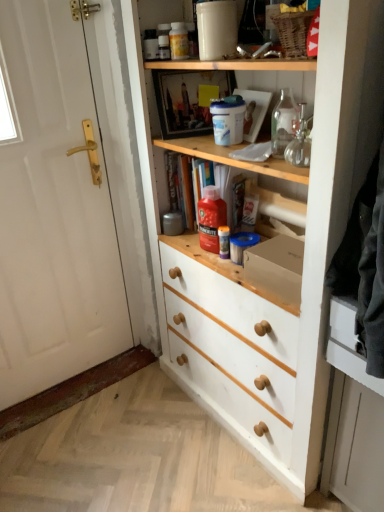
This screenshot has height=512, width=384. What do you see at coordinates (53, 211) in the screenshot? I see `white matte door at left` at bounding box center [53, 211].

Looking at this image, what is the approximate height of white matte drawer at lower right?

It is 22.89 centimeters.

This screenshot has height=512, width=384. In order to click on translucent plastic bottle at upper center, which is the 1th bottle from left to right in this screenshot , I will do `click(178, 41)`.

You are a GUI agent. You are given a task and a screenshot of the screen. Output one action in this format:
    pyautogui.click(x=<x>, y=<y>)
    Task: Click on the white matte door at left
    
    Given the screenshot: What is the action you would take?
    pyautogui.click(x=53, y=211)

Considering the sizes of objects transparent glass bottle at upper right and translucent plastic bottle at upper center, marked as the 1th bottle in a top-to-bottom arrangement, in the image provided, who is thinner, transparent glass bottle at upper right or translucent plastic bottle at upper center, marked as the 1th bottle in a top-to-bottom arrangement,?

Thinner between the two is transparent glass bottle at upper right.

Considering the relative sizes of transparent glass bottle at upper right and translucent plastic bottle at upper center, which is the 1th bottle from left to right, in the image provided, is transparent glass bottle at upper right taller than translucent plastic bottle at upper center, which is the 1th bottle from left to right,?

Correct, transparent glass bottle at upper right is much taller as translucent plastic bottle at upper center, which is the 1th bottle from left to right.

Is the position of transparent glass bottle at upper right more distant than that of translucent plastic bottle at upper center, marked as the 1th bottle in a top-to-bottom arrangement?

No, transparent glass bottle at upper right is in front of translucent plastic bottle at upper center, marked as the 1th bottle in a top-to-bottom arrangement.

Which is farther from the camera, (275, 296) or (333, 362)?

Point (275, 296)

Is white painted wood cupboard at center bigger or smaller than white matte drawer at lower right?

In the image, white painted wood cupboard at center appears to be larger than white matte drawer at lower right.

From the image's perspective, does white painted wood cupboard at center appear lower than white matte drawer at lower right?

Incorrect, from the image's perspective, white painted wood cupboard at center is higher than white matte drawer at lower right.

Consider the image. Is white painted wood cupboard at center behind white matte drawer at lower right?

No, white painted wood cupboard at center is in front of white matte drawer at lower right.

Considering the positions of objects translucent plastic bottle at upper center, which is the 1th bottle from left to right, and white matte door at left in the image provided, who is behind, translucent plastic bottle at upper center, which is the 1th bottle from left to right, or white matte door at left?

translucent plastic bottle at upper center, which is the 1th bottle from left to right.

From the image's perspective, does translucent plastic bottle at upper center, which is counted as the second bottle, starting from the bottom, appear lower than white matte door at left?

No.

Are translucent plastic bottle at upper center, marked as the 1th bottle in a top-to-bottom arrangement, and white matte door at left located far from each other?

No, translucent plastic bottle at upper center, marked as the 1th bottle in a top-to-bottom arrangement, is in close proximity to white matte door at left.

Between white matte drawer at lower right and transparent glass bottle at upper right, which one has smaller size?

transparent glass bottle at upper right.

Which is more to the left, white matte drawer at lower right or transparent glass bottle at upper right?

From the viewer's perspective, transparent glass bottle at upper right appears more on the left side.

From their relative heights in the image, would you say white matte drawer at lower right is taller or shorter than transparent glass bottle at upper right?

In the image, white matte drawer at lower right appears to be taller than transparent glass bottle at upper right.

How many degrees apart are the facing directions of white matte drawer at lower right and transparent glass bottle at upper right?

white matte drawer at lower right and transparent glass bottle at upper right are facing 29.5 degrees away from each other.

From a real-world perspective, is translucent plastic bottle at upper center, which is the 1th bottle from left to right, located higher than white matte drawer at lower right?

Yes, from a real-world perspective, translucent plastic bottle at upper center, which is the 1th bottle from left to right, is above white matte drawer at lower right.

Considering the relative sizes of translucent plastic bottle at upper center, which is counted as the 2th bottle, starting from the right, and white matte drawer at lower right in the image provided, is translucent plastic bottle at upper center, which is counted as the 2th bottle, starting from the right, shorter than white matte drawer at lower right?

Yes, translucent plastic bottle at upper center, which is counted as the 2th bottle, starting from the right, is shorter than white matte drawer at lower right.

Find the location of a particular element. the 1st bottle behind when counting from the white matte drawer at lower right is located at coordinates (178, 41).

Is translucent plastic bottle at upper center, which is counted as the 2th bottle, starting from the right, positioned far away from white matte drawer at lower right?

Yes, translucent plastic bottle at upper center, which is counted as the 2th bottle, starting from the right, and white matte drawer at lower right are located far from each other.

Considering the relative sizes of transparent glass bottle at upper right and white painted wood cupboard at center in the image provided, is transparent glass bottle at upper right thinner than white painted wood cupboard at center?

Yes.

Between point (306, 127) and point (335, 143), which one is positioned behind?

The point (306, 127) is farther.

From a real-world perspective, is transparent glass bottle at upper right physically located above or below white painted wood cupboard at center?

In terms of real-world spatial position, transparent glass bottle at upper right is above white painted wood cupboard at center.

Is red plastic bottle at center, which is the 1th bottle from bottom to top, wider or thinner than transparent glass bottle at upper right?

In the image, red plastic bottle at center, which is the 1th bottle from bottom to top, appears to be more narrow than transparent glass bottle at upper right.

From a real-world perspective, who is located lower, red plastic bottle at center, which is the 1th bottle from bottom to top, or transparent glass bottle at upper right?

red plastic bottle at center, which is the 1th bottle from bottom to top.

Considering the positions of objects red plastic bottle at center, placed as the second bottle when sorted from left to right, and transparent glass bottle at upper right in the image provided, who is behind, red plastic bottle at center, placed as the second bottle when sorted from left to right, or transparent glass bottle at upper right?

red plastic bottle at center, placed as the second bottle when sorted from left to right, is further from the camera.

From the image's perspective, is red plastic bottle at center, which is the 1th bottle from bottom to top, above or below transparent glass bottle at upper right?

Based on their image positions, red plastic bottle at center, which is the 1th bottle from bottom to top, is located beneath transparent glass bottle at upper right.

You are a GUI agent. You are given a task and a screenshot of the screen. Output one action in this format:
    pyautogui.click(x=<x>, y=<y>)
    Task: Click on the bottle above the transparent glass bottle at upper right (from the image's perspective)
    
    Given the screenshot: What is the action you would take?
    pyautogui.click(x=178, y=41)

This screenshot has height=512, width=384. Find the location of `drawer behind the white painted wood cupboard at center`. drawer behind the white painted wood cupboard at center is located at coordinates (348, 344).

From the image, which object appears to be farther from white painted wood cupboard at center, transparent glass bottle at upper right or translucent plastic bottle at upper center, marked as the 1th bottle in a top-to-bottom arrangement?

The object further to white painted wood cupboard at center is translucent plastic bottle at upper center, marked as the 1th bottle in a top-to-bottom arrangement.

From the image, which object appears to be farther from transparent glass bottle at upper right, white matte door at left or white painted wood cupboard at center?

white matte door at left is further to transparent glass bottle at upper right.

Estimate the real-world distances between objects in this image. Which object is closer to red plastic bottle at center, marked as the second bottle in a top-to-bottom arrangement, transparent glass bottle at upper right or white matte door at left?

transparent glass bottle at upper right is positioned closer to the anchor red plastic bottle at center, marked as the second bottle in a top-to-bottom arrangement.

Based on their spatial positions, is transparent glass bottle at upper right or white matte door at left further from white painted wood cupboard at center?

Among the two, white matte door at left is located further to white painted wood cupboard at center.

From the image, which object appears to be nearer to red plastic bottle at center, the 1th bottle positioned from the right, white matte door at left or white painted wood cupboard at center?

Based on the image, white painted wood cupboard at center appears to be nearer to red plastic bottle at center, the 1th bottle positioned from the right.

Based on their spatial positions, is white matte drawer at lower right or red plastic bottle at center, which is the 1th bottle from bottom to top, closer to translucent plastic bottle at upper center, which is counted as the 2th bottle, starting from the right?

red plastic bottle at center, which is the 1th bottle from bottom to top, is closer to translucent plastic bottle at upper center, which is counted as the 2th bottle, starting from the right.

Which object lies nearer to the anchor point white matte drawer at lower right, transparent glass bottle at upper right or white painted wood cupboard at center?

Based on the image, white painted wood cupboard at center appears to be nearer to white matte drawer at lower right.

From the image, which object appears to be nearer to red plastic bottle at center, marked as the second bottle in a top-to-bottom arrangement, white matte drawer at lower right or transparent glass bottle at upper right?

The object closer to red plastic bottle at center, marked as the second bottle in a top-to-bottom arrangement, is transparent glass bottle at upper right.

Identify the location of cupboard between translucent plastic bottle at upper center, which is the 1th bottle from left to right, and white matte drawer at lower right from top to bottom. The height and width of the screenshot is (512, 384). (288, 258).

Locate an element on the screen. This screenshot has width=384, height=512. glass jar between translucent plastic bottle at upper center, which is the 1th bottle from left to right, and white painted wood cupboard at center vertically is located at coordinates (300, 142).

Identify the location of bottle situated between white matte door at left and red plastic bottle at center, marked as the second bottle in a top-to-bottom arrangement, from left to right. (178, 41).

Image resolution: width=384 pixels, height=512 pixels. Identify the location of cupboard between white matte door at left and white matte drawer at lower right in the horizontal direction. (288, 258).